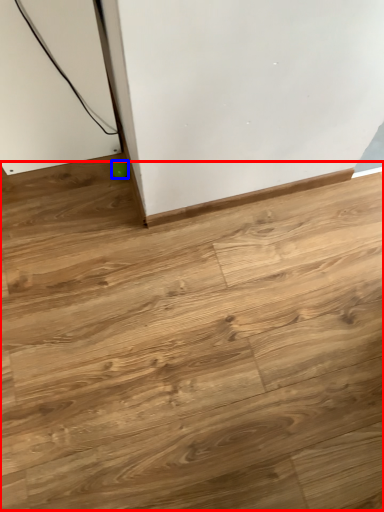
Question: Which object appears farthest to the camera in this image, plywood (highlighted by a red box) or ball (highlighted by a blue box)?

Choices:
 (A) plywood
 (B) ball

Answer: (B)